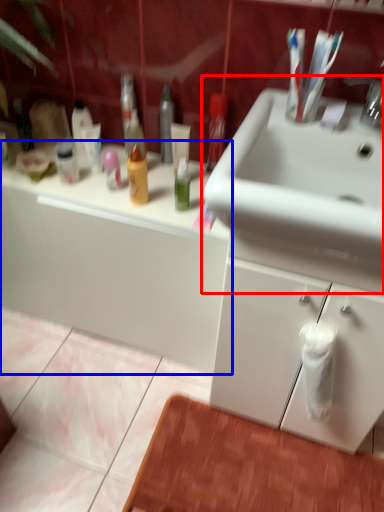
Question: Which point is closer to the camera, sink (highlighted by a red box) or bathroom cabinet (highlighted by a blue box)?

Choices:
 (A) sink
 (B) bathroom cabinet

Answer: (A)